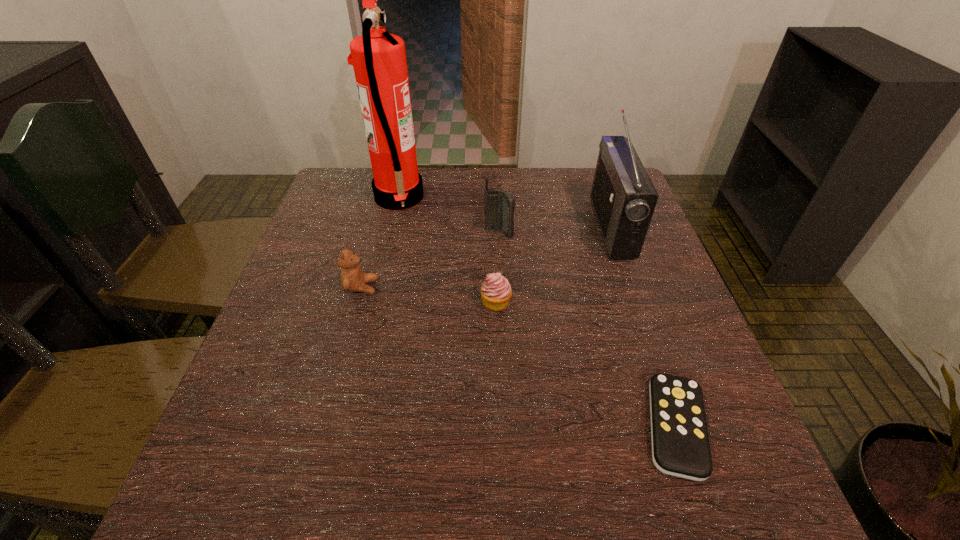
This screenshot has height=540, width=960. Find the location of `fire extinguisher`. fire extinguisher is located at coordinates (379, 60).

You are a GUI agent. You are given a task and a screenshot of the screen. Output one action in this format:
    pyautogui.click(x=<x>, y=<y>)
    Task: Click on the radio receiver
    
    Given the screenshot: What is the action you would take?
    pyautogui.click(x=623, y=197)

Identify the location of cellular telephone. (499, 206).

Where is `teddy bear`? This screenshot has width=960, height=540. teddy bear is located at coordinates (352, 278).

Locate an element on the screen. This screenshot has width=960, height=540. cupcake is located at coordinates (496, 291).

Identify the location of the shortest object. (680, 443).

Find the location of a particular element. This screenshot has width=960, height=540. the nearest object is located at coordinates (680, 443).

Find the location of `vacant region located with the nozzle aimed from the tallest object`. vacant region located with the nozzle aimed from the tallest object is located at coordinates (512, 198).

Find the location of a particular element. The height and width of the screenshot is (540, 960). free space located on the front-facing side of the radio receiver is located at coordinates (471, 227).

The image size is (960, 540). In order to click on free space located 0.080m on the front-facing side of the radio receiver in this screenshot , I will do `click(567, 227)`.